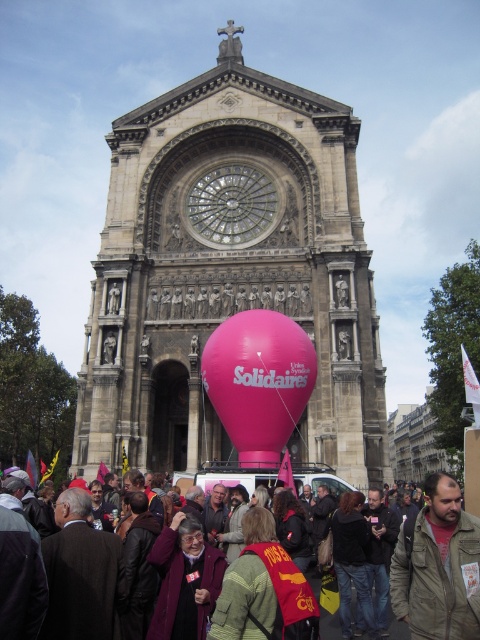
Is point (450, 600) behind point (239, 172)?

No, it is in front of (239, 172).

The width and height of the screenshot is (480, 640). Describe the element at coordinates (437, 566) in the screenshot. I see `brown textured jacket at lower right` at that location.

You are a GUI agent. You are given a task and a screenshot of the screen. Output one action in this format:
    pyautogui.click(x=<x>, y=<y>)
    Task: Click on the brown textured jacket at lower right
    The height and width of the screenshot is (640, 480).
    Given the screenshot: What is the action you would take?
    pyautogui.click(x=437, y=566)

Does pink fabric balloon at center have a lesser width compared to pink matte balloon at center?

No, pink fabric balloon at center is not thinner than pink matte balloon at center.

Is point (324, 125) more distant than point (303, 339)?

Yes, it is.

Identify the location of pink fabric balloon at center. The image size is (480, 640). (228, 272).

Is pink fabric balloon at center further to camera compared to clear glass clock at center?

No, pink fabric balloon at center is closer to the viewer.

Does pink fabric balloon at center have a greater width compared to clear glass clock at center?

Indeed, pink fabric balloon at center has a greater width compared to clear glass clock at center.

Who is more distant from viewer, (192, 352) or (232, 230)?

Positioned behind is point (232, 230).

The width and height of the screenshot is (480, 640). I want to click on pink fabric balloon at center, so click(x=228, y=272).